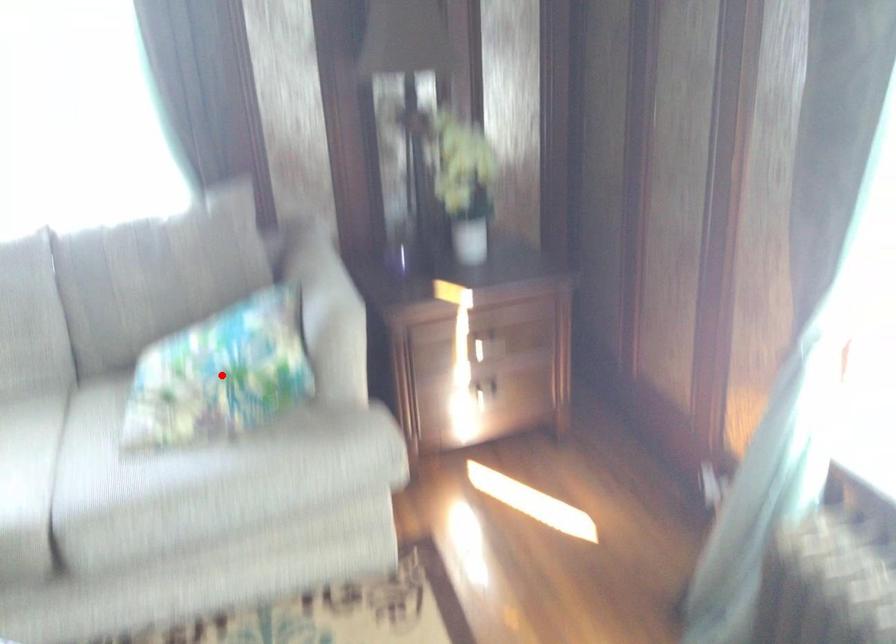
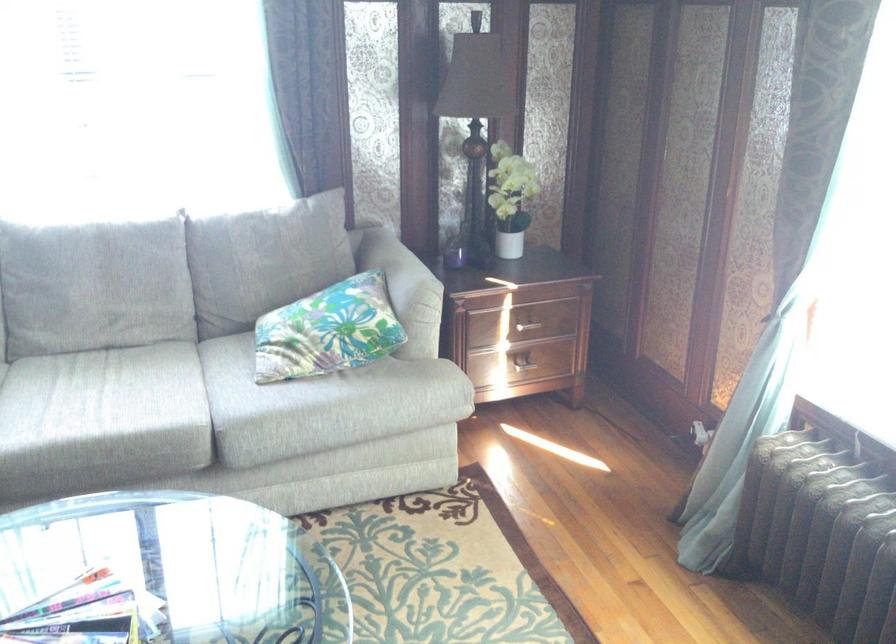
Question: I am providing you with two images of the same scene from different viewpoints. Given a red point in image1, look at the same physical point in image2. Is it:

Choices:
 (A) Closer to the viewpoint
 (B) Farther from the viewpoint

Answer: (B)